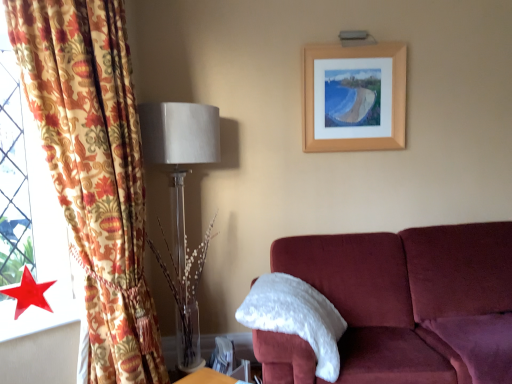
What is the approximate height of red glossy star at lower left?

red glossy star at lower left is 23.63 centimeters tall.

From the picture: Measure the distance between wooden picture frame at upper center and camera.

The distance of wooden picture frame at upper center from camera is 2.67 meters.

What do you see at coordinates (296, 317) in the screenshot? The height and width of the screenshot is (384, 512). I see `white fluffy pillow at right` at bounding box center [296, 317].

Identify the location of translucent glass vase at left. The width and height of the screenshot is (512, 384). pos(182,199).

In the scene shown: Considering the positions of objects red glossy star at lower left and white fluffy pillow at right in the image provided, who is more to the right, red glossy star at lower left or white fluffy pillow at right?

white fluffy pillow at right.

Between red glossy star at lower left and white fluffy pillow at right, which one has smaller size?

red glossy star at lower left.

Is red glossy star at lower left outside of white fluffy pillow at right?

That's correct, red glossy star at lower left is outside of white fluffy pillow at right.

From a real-world perspective, is red glossy star at lower left physically located above or below white fluffy pillow at right?

Clearly, from a real-world perspective, red glossy star at lower left is above white fluffy pillow at right.

Identify the location of table lamp in front of the wooden picture frame at upper center. This screenshot has width=512, height=384. (182, 199).

From the image's perspective, is translucent glass vase at left above wooden picture frame at upper center?

Incorrect, from the image's perspective, translucent glass vase at left is lower than wooden picture frame at upper center.

Which of these two, translucent glass vase at left or wooden picture frame at upper center, is wider?

Wider between the two is translucent glass vase at left.

Is white fluffy pillow at right oriented away from red glossy star at lower left?

Yes.

In terms of size, does white fluffy pillow at right appear bigger or smaller than red glossy star at lower left?

Clearly, white fluffy pillow at right is larger in size than red glossy star at lower left.

Considering the points (286, 284) and (34, 302), which point is in front, point (286, 284) or point (34, 302)?

The point (34, 302) is closer to the camera.

From a real-world perspective, relative to red glossy star at lower left, is white fluffy pillow at right vertically above or below?

In terms of real-world spatial position, white fluffy pillow at right is below red glossy star at lower left.

Is floral fabric curtain at left to the left or to the right of red glossy star at lower left in the image?

Clearly, floral fabric curtain at left is on the right of red glossy star at lower left in the image.

Are floral fabric curtain at left and red glossy star at lower left far apart?

No, floral fabric curtain at left is in close proximity to red glossy star at lower left.

Is floral fabric curtain at left oriented towards red glossy star at lower left?

No, floral fabric curtain at left is not oriented towards red glossy star at lower left.

You are a GUI agent. You are given a task and a screenshot of the screen. Output one action in this format:
    pyautogui.click(x=<x>, y=<y>)
    Task: Click on the star on the left of floral fabric curtain at left
    
    Given the screenshot: What is the action you would take?
    pos(29,293)

Where is `picture frame above the floral fabric curtain at left (from the image's perspective)`? The width and height of the screenshot is (512, 384). picture frame above the floral fabric curtain at left (from the image's perspective) is located at coordinates (354, 97).

Could wooden picture frame at upper center be considered to be inside floral fabric curtain at left?

No, wooden picture frame at upper center is not inside floral fabric curtain at left.

Could you tell me if floral fabric curtain at left is turned towards wooden picture frame at upper center?

No, floral fabric curtain at left is not turned towards wooden picture frame at upper center.

Can you see floral fabric curtain at left touching wooden picture frame at upper center?

floral fabric curtain at left and wooden picture frame at upper center are not in contact.

Which object is more forward, wooden picture frame at upper center or translucent glass vase at left?

translucent glass vase at left.

Which of these two, wooden picture frame at upper center or translucent glass vase at left, is bigger?

Bigger between the two is translucent glass vase at left.

Locate an element on the screen. table lamp lying on the left of wooden picture frame at upper center is located at coordinates (182, 199).

Can you tell me how much wooden picture frame at upper center and translucent glass vase at left differ in facing direction?

The facing directions of wooden picture frame at upper center and translucent glass vase at left are 1.86 degrees apart.

From a real-world perspective, which is physically above, wooden picture frame at upper center or floral fabric curtain at left?

From a 3D spatial view, wooden picture frame at upper center is above.

From the image's perspective, is wooden picture frame at upper center located beneath floral fabric curtain at left?

Actually, wooden picture frame at upper center appears above floral fabric curtain at left in the image.

Who is smaller, wooden picture frame at upper center or floral fabric curtain at left?

Smaller between the two is wooden picture frame at upper center.

The width and height of the screenshot is (512, 384). What are the coordinates of `star above the white fluffy pillow at right (from a real-world perspective)` in the screenshot? It's located at (29, 293).

What are the coordinates of `table lamp on the left of wooden picture frame at upper center` in the screenshot? It's located at (182, 199).

When comparing their distances from white fluffy pillow at right, does red glossy star at lower left or wooden picture frame at upper center seem closer?

The object closer to white fluffy pillow at right is red glossy star at lower left.

Looking at the image, which one is located further to white fluffy pillow at right, red glossy star at lower left or translucent glass vase at left?

red glossy star at lower left is positioned further to the anchor white fluffy pillow at right.

Which object lies further to the anchor point white fluffy pillow at right, wooden picture frame at upper center or red glossy star at lower left?

wooden picture frame at upper center lies further to white fluffy pillow at right than the other object.

Based on their spatial positions, is red glossy star at lower left or translucent glass vase at left further from wooden picture frame at upper center?

red glossy star at lower left is positioned further to the anchor wooden picture frame at upper center.

Estimate the real-world distances between objects in this image. Which object is closer to wooden picture frame at upper center, translucent glass vase at left or floral fabric curtain at left?

translucent glass vase at left is positioned closer to the anchor wooden picture frame at upper center.

Considering their positions, is red glossy star at lower left positioned closer to floral fabric curtain at left than translucent glass vase at left?

red glossy star at lower left is positioned closer to the anchor floral fabric curtain at left.

Looking at the image, which one is located closer to floral fabric curtain at left, wooden picture frame at upper center or red glossy star at lower left?

Among the two, red glossy star at lower left is located nearer to floral fabric curtain at left.

Which object lies further to the anchor point floral fabric curtain at left, red glossy star at lower left or wooden picture frame at upper center?

wooden picture frame at upper center.

I want to click on star between floral fabric curtain at left and translucent glass vase at left from front to back, so click(29, 293).

Identify the location of table lamp between red glossy star at lower left and wooden picture frame at upper center in the horizontal direction. (182, 199).

This screenshot has height=384, width=512. In order to click on table lamp between floral fabric curtain at left and white fluffy pillow at right from left to right in this screenshot , I will do `click(182, 199)`.

Where is `table lamp located between red glossy star at lower left and white fluffy pillow at right in the left-right direction`? This screenshot has width=512, height=384. table lamp located between red glossy star at lower left and white fluffy pillow at right in the left-right direction is located at coordinates [182, 199].